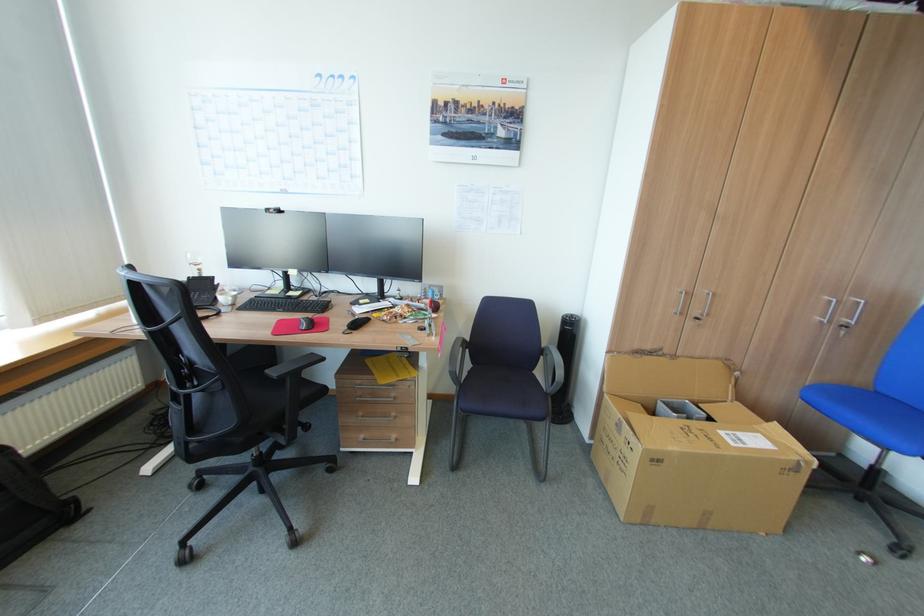
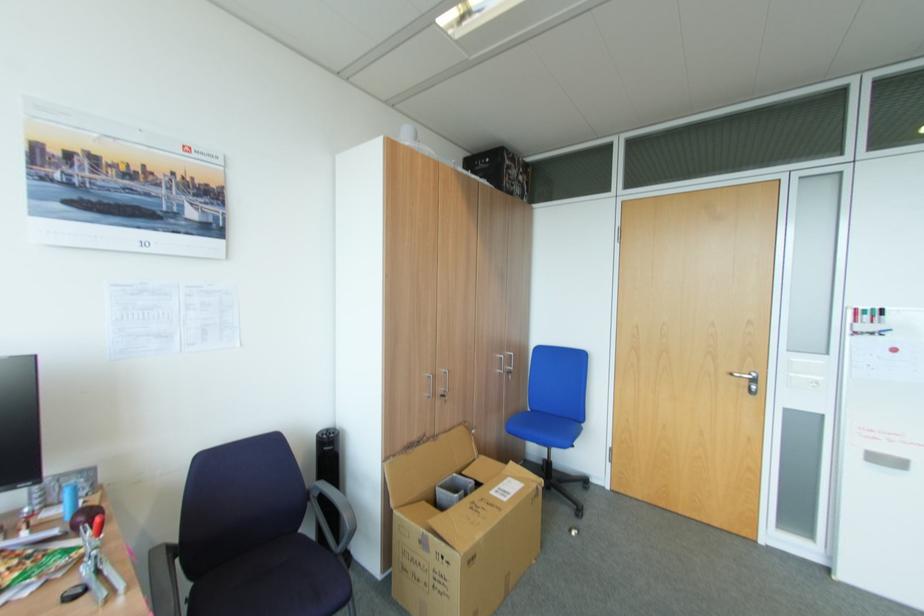
Find the pixel in the second image that matches the point at 824,322 in the first image.

(505, 371)